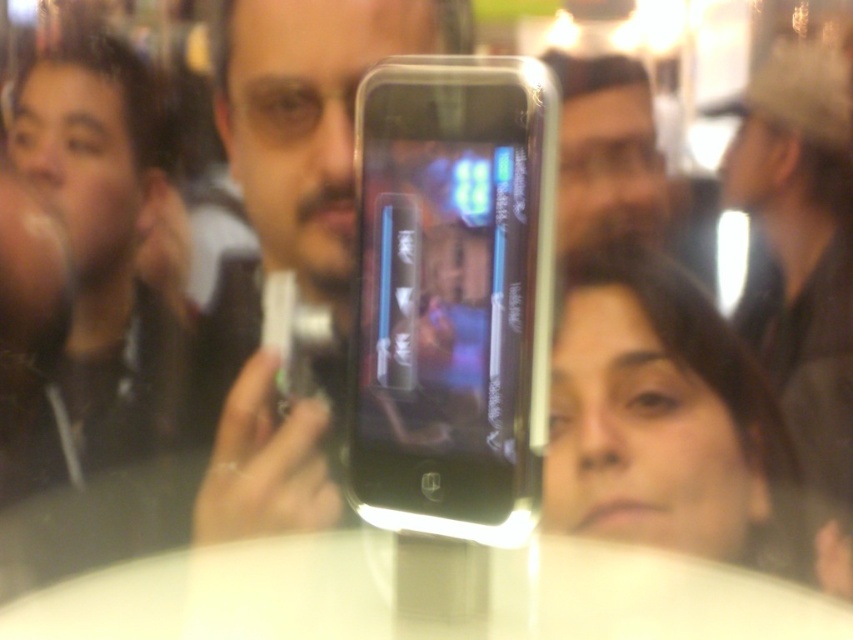
Question: Does white glossy round table at center appear under dark brown hair at left?

Choices:
 (A) yes
 (B) no

Answer: (A)

Question: Can you confirm if white glossy round table at center is positioned below dark brown hair at left?

Choices:
 (A) yes
 (B) no

Answer: (A)

Question: Which point appears farthest from the camera in this image?

Choices:
 (A) (277, 356)
 (B) (675, 509)
 (C) (158, 163)

Answer: (A)

Question: Which point is farther to the camera?

Choices:
 (A) dark brown hair at left
 (B) smooth brown hair at center
 (C) matte black phone at center

Answer: (A)

Question: Based on their relative distances, which object is nearer to the matte black phone at center?

Choices:
 (A) smooth brown hair at center
 (B) dark brown hair at left
 (C) white glossy round table at center

Answer: (B)

Question: Is matte black phone at center in front of white glossy round table at center?

Choices:
 (A) no
 (B) yes

Answer: (A)